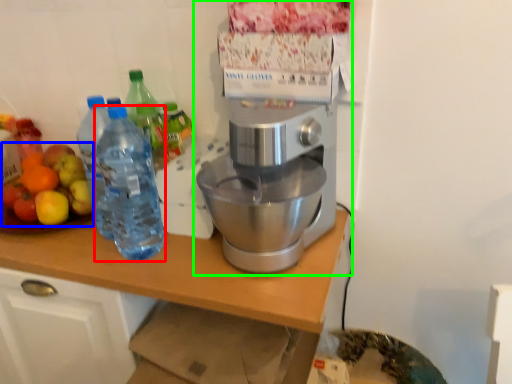
Question: Which object is positioned closest to bottle (highlighted by a red box)? Select from fruit salad (highlighted by a blue box) and coffee maker (highlighted by a green box).

Choices:
 (A) fruit salad
 (B) coffee maker

Answer: (A)